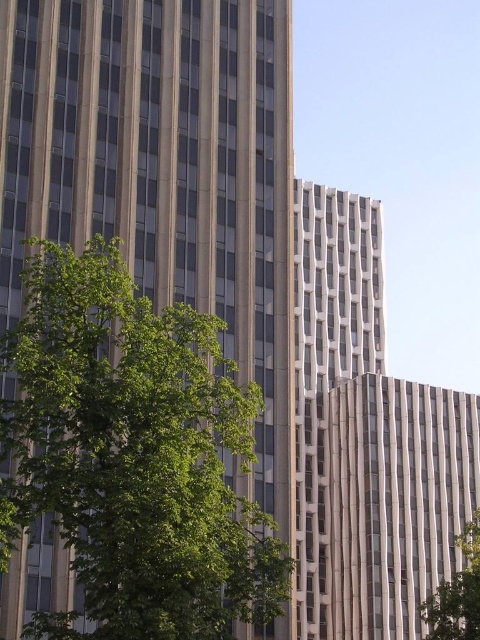
Question: Which point is farther from the camera taking this photo?

Choices:
 (A) (477, 540)
 (B) (45, 269)

Answer: (A)

Question: Can you confirm if green leafy tree at left is bigger than green leafy tree at lower right?

Choices:
 (A) no
 (B) yes

Answer: (A)

Question: Which point appears closest to the camera in this image?

Choices:
 (A) click(469, 540)
 (B) click(56, 244)

Answer: (B)

Question: Observing the image, what is the correct spatial positioning of green leafy tree at left in reference to green leafy tree at lower right?

Choices:
 (A) left
 (B) right

Answer: (A)

Question: Is green leafy tree at left closer to the viewer compared to green leafy tree at lower right?

Choices:
 (A) yes
 (B) no

Answer: (A)